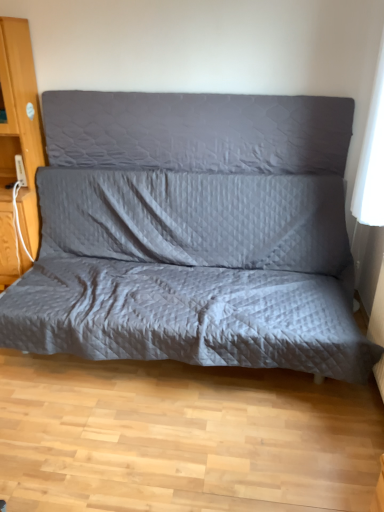
Question: Is gray quilted pillow at center further to the viewer compared to wooden dresser at left?

Choices:
 (A) no
 (B) yes

Answer: (B)

Question: Are gray quilted pillow at center and wooden dresser at left far apart?

Choices:
 (A) no
 (B) yes

Answer: (A)

Question: Can you confirm if gray quilted pillow at center is taller than wooden dresser at left?

Choices:
 (A) yes
 (B) no

Answer: (B)

Question: From a real-world perspective, is gray quilted pillow at center over wooden dresser at left?

Choices:
 (A) yes
 (B) no

Answer: (A)

Question: Can you confirm if gray quilted pillow at center is shorter than wooden dresser at left?

Choices:
 (A) yes
 (B) no

Answer: (A)

Question: Is quilted gray studio couch at center taller or shorter than wooden dresser at left?

Choices:
 (A) tall
 (B) short

Answer: (B)

Question: Based on their positions, is quilted gray studio couch at center located to the left or right of wooden dresser at left?

Choices:
 (A) left
 (B) right

Answer: (B)

Question: From the image's perspective, is quilted gray studio couch at center located above or below wooden dresser at left?

Choices:
 (A) below
 (B) above

Answer: (A)

Question: From a real-world perspective, relative to wooden dresser at left, is quilted gray studio couch at center vertically above or below?

Choices:
 (A) above
 (B) below

Answer: (B)

Question: Is gray quilted pillow at center spatially inside quilted gray studio couch at center, or outside of it?

Choices:
 (A) inside
 (B) outside

Answer: (B)

Question: In the image, is gray quilted pillow at center positioned in front of or behind quilted gray studio couch at center?

Choices:
 (A) front
 (B) behind

Answer: (B)

Question: Considering the relative positions of gray quilted pillow at center and quilted gray studio couch at center in the image provided, is gray quilted pillow at center to the left or to the right of quilted gray studio couch at center?

Choices:
 (A) left
 (B) right

Answer: (B)

Question: In terms of height, does gray quilted pillow at center look taller or shorter compared to quilted gray studio couch at center?

Choices:
 (A) tall
 (B) short

Answer: (B)

Question: Based on their sizes in the image, would you say quilted gray studio couch at center is bigger or smaller than gray quilted pillow at center?

Choices:
 (A) big
 (B) small

Answer: (A)

Question: Considering the positions of point (147, 94) and point (256, 124), is point (147, 94) closer or farther from the camera than point (256, 124)?

Choices:
 (A) closer
 (B) farther

Answer: (B)